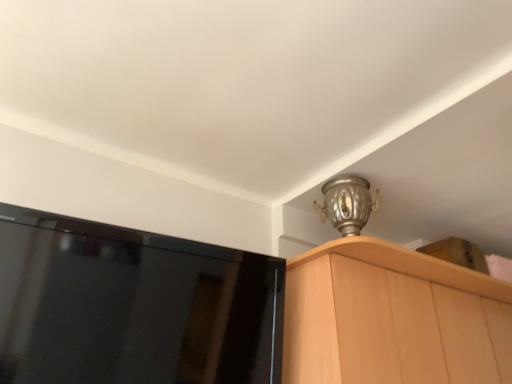
Question: Can you confirm if light wood cabinet at upper right is positioned to the right of black glossy screen at upper left?

Choices:
 (A) no
 (B) yes

Answer: (B)

Question: Is light wood cabinet at upper right outside black glossy screen at upper left?

Choices:
 (A) yes
 (B) no

Answer: (A)

Question: Is light wood cabinet at upper right further to camera compared to black glossy screen at upper left?

Choices:
 (A) no
 (B) yes

Answer: (B)

Question: Is light wood cabinet at upper right oriented towards black glossy screen at upper left?

Choices:
 (A) no
 (B) yes

Answer: (A)

Question: From a real-world perspective, does light wood cabinet at upper right sit lower than black glossy screen at upper left?

Choices:
 (A) yes
 (B) no

Answer: (B)

Question: From the image's perspective, would you say light wood cabinet at upper right is shown under black glossy screen at upper left?

Choices:
 (A) no
 (B) yes

Answer: (B)

Question: Is black glossy screen at upper left far from light wood cabinet at upper right?

Choices:
 (A) no
 (B) yes

Answer: (A)

Question: Is black glossy screen at upper left next to light wood cabinet at upper right?

Choices:
 (A) yes
 (B) no

Answer: (B)

Question: From a real-world perspective, does black glossy screen at upper left sit lower than light wood cabinet at upper right?

Choices:
 (A) yes
 (B) no

Answer: (A)

Question: Is light wood cabinet at upper right located within black glossy screen at upper left?

Choices:
 (A) no
 (B) yes

Answer: (A)

Question: From the image's perspective, is black glossy screen at upper left below light wood cabinet at upper right?

Choices:
 (A) yes
 (B) no

Answer: (B)

Question: Can we say black glossy screen at upper left lies outside light wood cabinet at upper right?

Choices:
 (A) yes
 (B) no

Answer: (A)

Question: From the image's perspective, is black glossy screen at upper left positioned above or below light wood cabinet at upper right?

Choices:
 (A) below
 (B) above

Answer: (B)